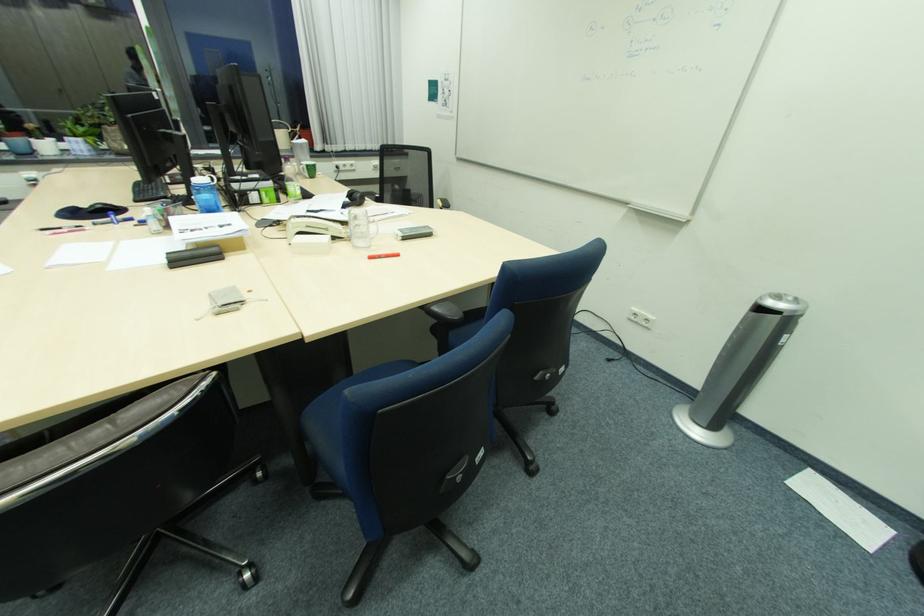
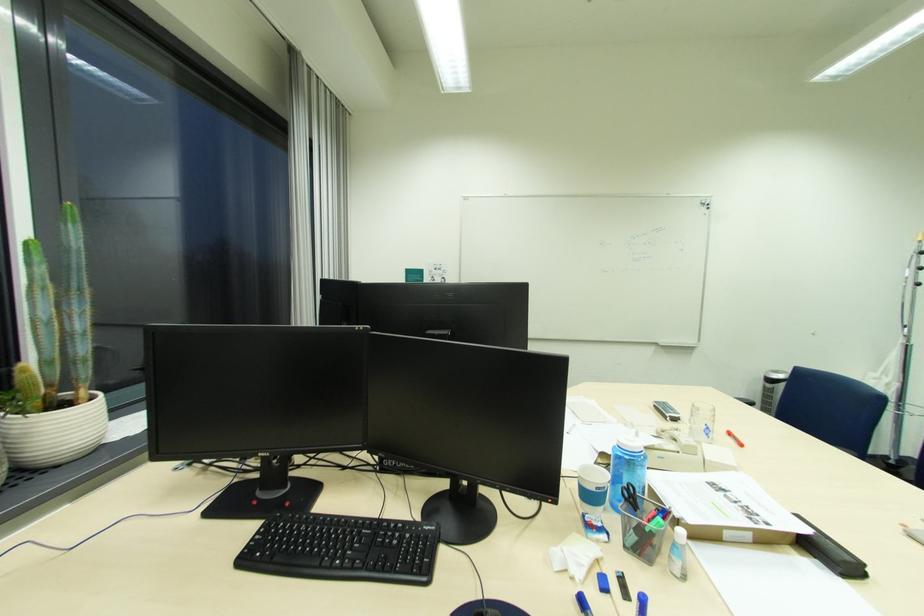
Where in the second image is the point corresponding to [228,227] from the first image?

(731, 491)